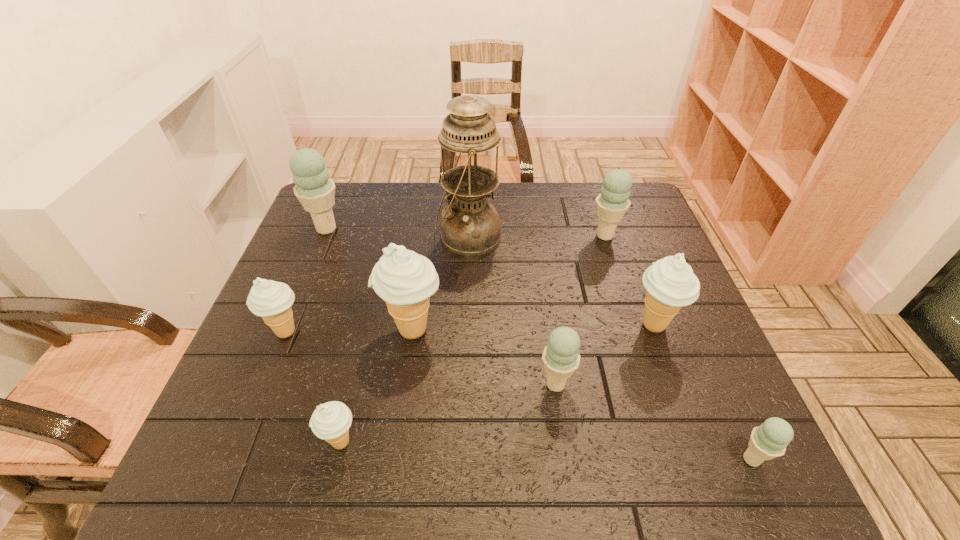
Identify the location of the tallest object. The width and height of the screenshot is (960, 540). (470, 226).

Identify the location of the leftmost blue ice cream. (314, 189).

I want to click on the biggest beige icecream, so click(x=405, y=280).

Locate an element on the screen. The height and width of the screenshot is (540, 960). the third blue ice cream from left to right is located at coordinates pos(612,203).

I want to click on the second biggest beige icecream, so click(670, 282).

Image resolution: width=960 pixels, height=540 pixels. Find the location of `the second smallest beige icecream`. the second smallest beige icecream is located at coordinates (271, 300).

Identify the location of the third blue ice cream from right to left. Image resolution: width=960 pixels, height=540 pixels. (561, 357).

Locate an element on the screen. The width and height of the screenshot is (960, 540). the third biggest blue ice cream is located at coordinates (561, 357).

Find the location of `the smallest beige icecream`. the smallest beige icecream is located at coordinates (330, 421).

The image size is (960, 540). I want to click on the rightmost ice cream, so click(769, 440).